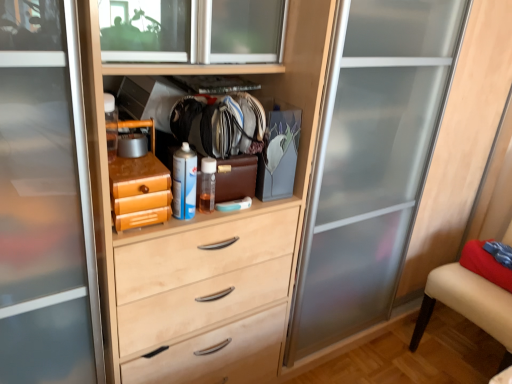
Find the location of a particular element. free area below beige fabric armchair at right (from a real-world perspective) is located at coordinates 468,353.